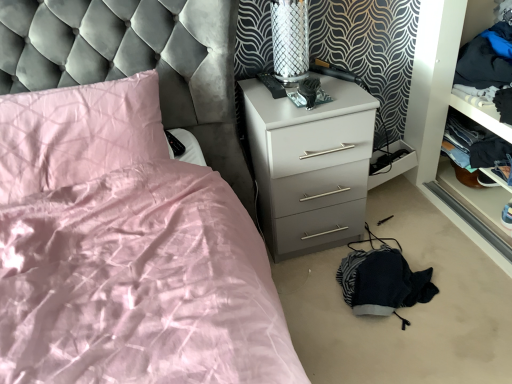
Question: From the image's perspective, is white glossy chest of drawers at center on top of dark blue fabric at right, which ranks as the first clothing in top-to-bottom order?

Choices:
 (A) yes
 (B) no

Answer: (B)

Question: Is white glossy chest of drawers at center closer to camera compared to dark blue fabric at right, which ranks as the first clothing in top-to-bottom order?

Choices:
 (A) yes
 (B) no

Answer: (A)

Question: Is white glossy chest of drawers at center located outside dark blue fabric at right, which ranks as the first clothing in top-to-bottom order?

Choices:
 (A) no
 (B) yes

Answer: (B)

Question: Is white glossy chest of drawers at center turned away from dark blue fabric at right, which ranks as the first clothing in top-to-bottom order?

Choices:
 (A) yes
 (B) no

Answer: (B)

Question: Is white glossy chest of drawers at center to the left of dark blue fabric at right, which ranks as the first clothing in top-to-bottom order, from the viewer's perspective?

Choices:
 (A) yes
 (B) no

Answer: (A)

Question: Looking at their shapes, would you say dark blue fabric at right, which is the 2th clothing in bottom-to-top order, is wider or thinner than metallic mesh table lamp at upper right?

Choices:
 (A) wide
 (B) thin

Answer: (A)

Question: In the image, is dark blue fabric at right, which ranks as the first clothing in top-to-bottom order, on the left side or the right side of metallic mesh table lamp at upper right?

Choices:
 (A) left
 (B) right

Answer: (B)

Question: In the image, is dark blue fabric at right, which ranks as the first clothing in top-to-bottom order, positioned in front of or behind metallic mesh table lamp at upper right?

Choices:
 (A) front
 (B) behind

Answer: (B)

Question: From the image's perspective, is dark blue fabric at right, which is the 2th clothing in bottom-to-top order, positioned above or below metallic mesh table lamp at upper right?

Choices:
 (A) below
 (B) above

Answer: (B)

Question: Do you think white glossy chest of drawers at center is within dark blue fabric at right, which ranks as the 1th clothing in bottom-to-top order, or outside of it?

Choices:
 (A) inside
 (B) outside

Answer: (B)

Question: Looking at their shapes, would you say white glossy chest of drawers at center is wider or thinner than dark blue fabric at right, which ranks as the 1th clothing in bottom-to-top order?

Choices:
 (A) thin
 (B) wide

Answer: (B)

Question: Considering the positions of white glossy chest of drawers at center and dark blue fabric at right, which ranks as the 1th clothing in bottom-to-top order, in the image, is white glossy chest of drawers at center taller or shorter than dark blue fabric at right, which ranks as the 1th clothing in bottom-to-top order,?

Choices:
 (A) short
 (B) tall

Answer: (B)

Question: Visually, is white glossy chest of drawers at center positioned to the left or to the right of dark blue fabric at right, which ranks as the 1th clothing in bottom-to-top order?

Choices:
 (A) right
 (B) left

Answer: (B)

Question: From the image's perspective, is dark blue fabric at right, which ranks as the 1th clothing in bottom-to-top order, positioned above or below dark blue fabric at right, which ranks as the first clothing in top-to-bottom order?

Choices:
 (A) above
 (B) below

Answer: (B)

Question: Does point tap(502, 145) appear closer or farther from the camera than point tap(502, 43)?

Choices:
 (A) farther
 (B) closer

Answer: (A)